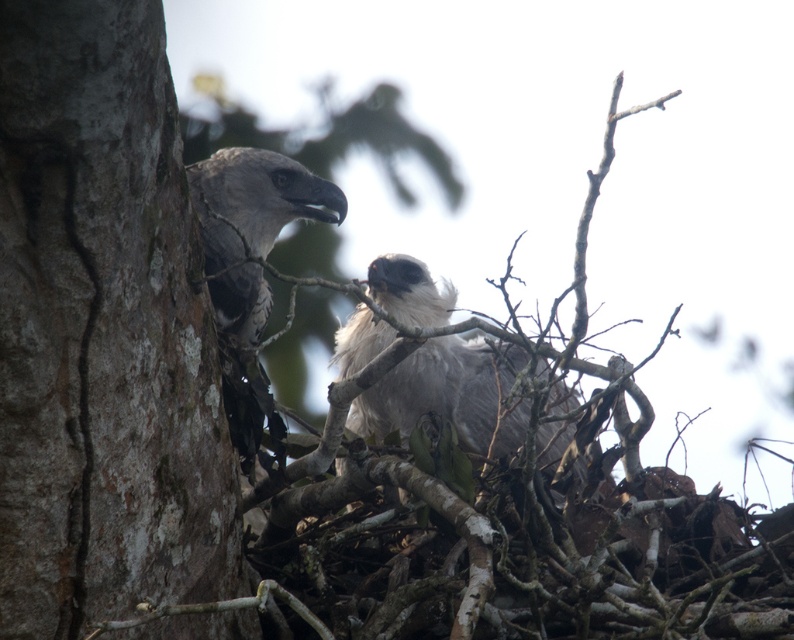
Is rough bark tree trunk at left thinner than gray fluffy eagle at center?

Indeed, rough bark tree trunk at left has a lesser width compared to gray fluffy eagle at center.

Is rough bark tree trunk at left bigger than gray fluffy eagle at center?

No.

Between point (160, 582) and point (382, 266), which one is positioned in front?

Point (160, 582)

What are the coordinates of `rough bark tree trunk at left` in the screenshot? It's located at (102, 332).